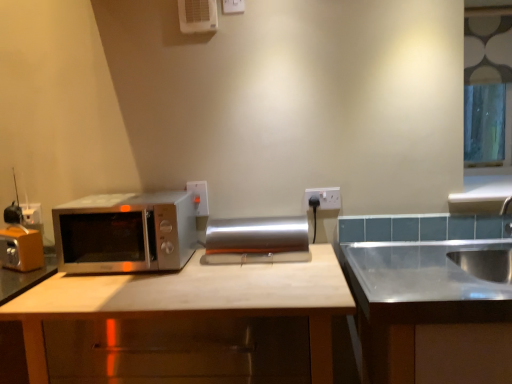
The image size is (512, 384). In order to click on free space in front of silver metallic paper towel holder at center in this screenshot , I will do `click(255, 274)`.